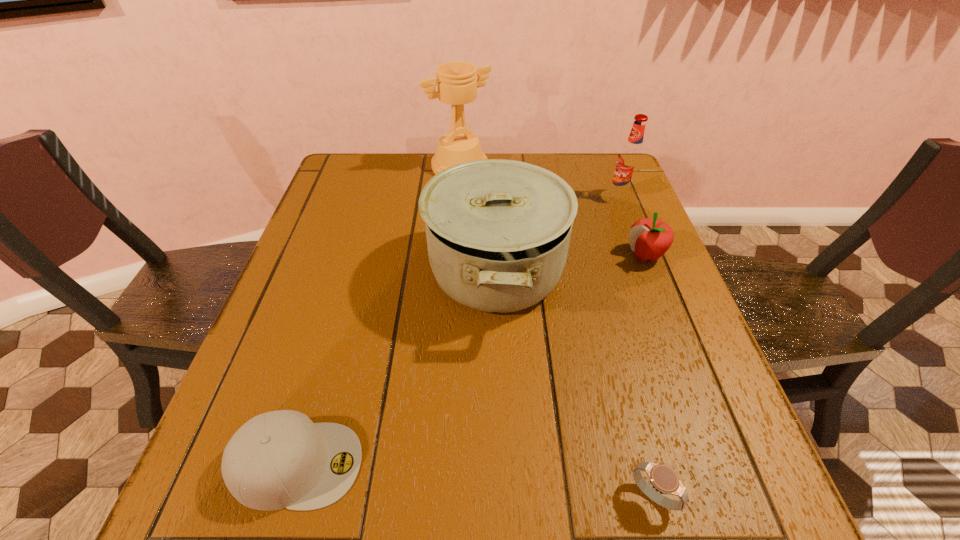
Identify the location of root beer present at the right edge. This screenshot has width=960, height=540. click(x=630, y=159).

Find the location of `apple present at the right edge`. apple present at the right edge is located at coordinates (650, 238).

This screenshot has height=540, width=960. Find the location of `watch that is at the right edge`. watch that is at the right edge is located at coordinates (663, 478).

This screenshot has width=960, height=540. I want to click on object present at the near left corner, so click(280, 459).

I want to click on object that is at the far right corner, so click(x=630, y=159).

You are a GUI agent. You are given a task and a screenshot of the screen. Output one action in this format:
    pyautogui.click(x=<x>, y=<y>)
    Task: Click on the object positioned at the near right corner
    
    Given the screenshot: What is the action you would take?
    pyautogui.click(x=663, y=478)

Locate an element on the screen. vacant position at the far edge of the desktop is located at coordinates (563, 167).

This screenshot has height=540, width=960. Find the location of `free space at the near edge of the desktop`. free space at the near edge of the desktop is located at coordinates (555, 525).

Image resolution: width=960 pixels, height=540 pixels. Find the location of `blank area at the left edge`. blank area at the left edge is located at coordinates (319, 207).

Find the location of `vacant space at the right edge of the desktop`. vacant space at the right edge of the desktop is located at coordinates (668, 343).